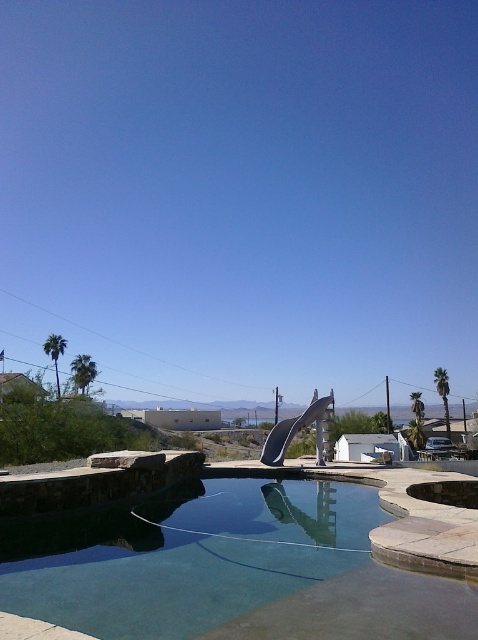
Question: Is clear glass pool at center further to camera compared to metallic silver slide at center?

Choices:
 (A) no
 (B) yes

Answer: (A)

Question: Does clear glass pool at center appear on the right side of metallic silver slide at center?

Choices:
 (A) yes
 (B) no

Answer: (B)

Question: Is the position of clear glass pool at center more distant than that of metallic silver slide at center?

Choices:
 (A) no
 (B) yes

Answer: (A)